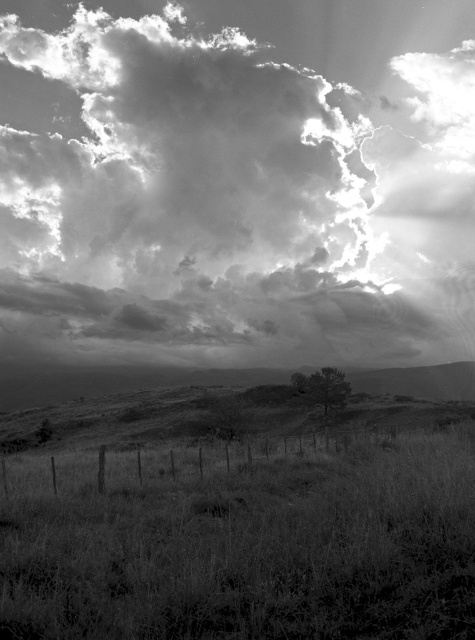
You are an artist sketching this landscape. You want to draw the cloudy sky at upper center and the dark green textured tree at center. Which object should you sketch first if you follow the rule of starting with elements that are further away?

The cloudy sky at upper center should be sketched first because it is positioned to the left of the dark green textured tree at center, indicating it is farther away in the scene.

In the black and white photograph, there is a point labeled as point [237,188]. Based on the scene description, what does this point most likely represent?

The point [237,188] most likely represents the cloudy sky at upper center as described in the scene.